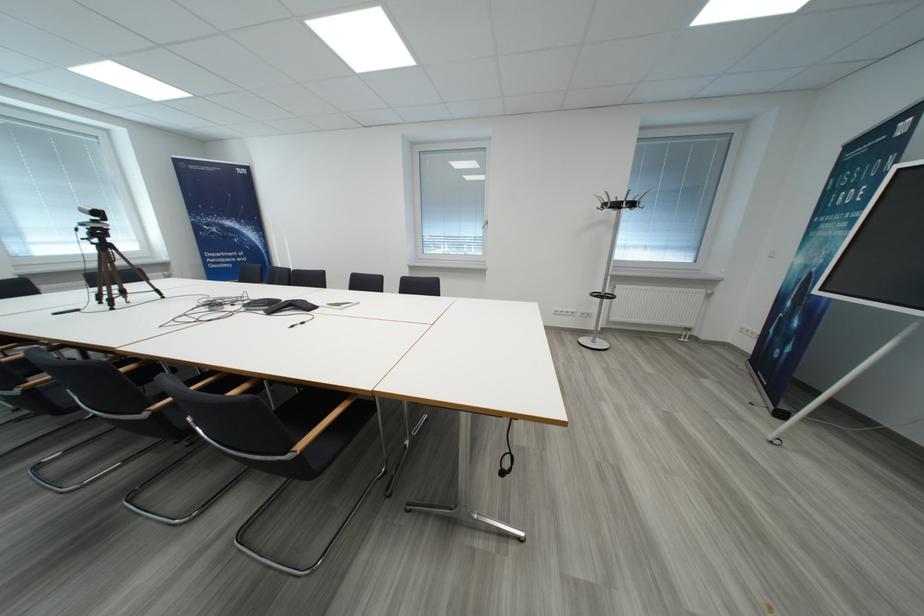
You are a GUI agent. You are given a task and a screenshot of the screen. Output one action in this format:
    pyautogui.click(x=<x>, y=<y>)
    Task: Click on the green booklet
    
    Given the screenshot: What is the action you would take?
    pyautogui.click(x=823, y=252)